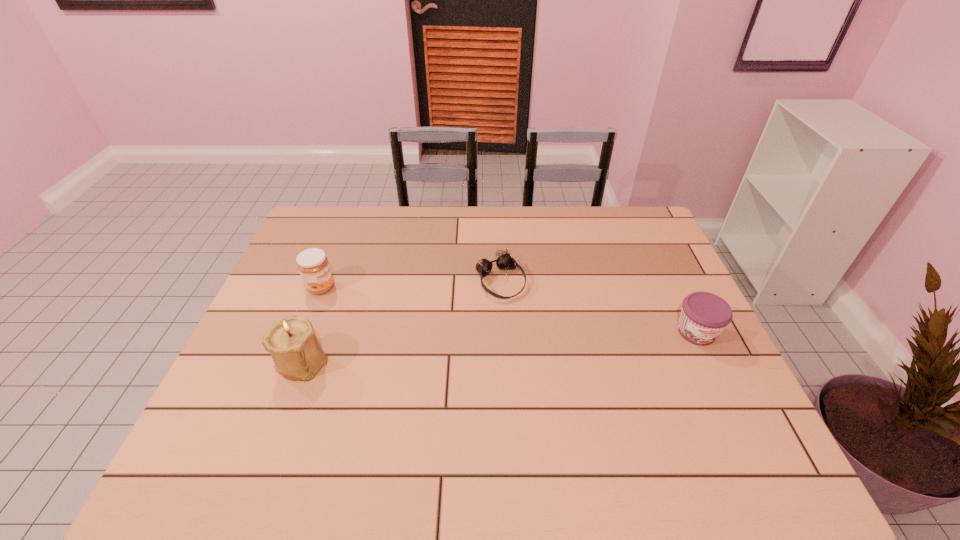
Where is `candle_holder`? candle_holder is located at coordinates 292,343.

Find the location of a particular element. Image resolution: width=960 pixels, height=540 pixels. the right jam is located at coordinates (704, 315).

Locate an element on the screen. This screenshot has width=960, height=540. the rightmost object is located at coordinates (704, 315).

Identify the location of the second tallest object. The height and width of the screenshot is (540, 960). (313, 265).

Find the location of `the left jam`. the left jam is located at coordinates 313,265.

The height and width of the screenshot is (540, 960). I want to click on goggles, so click(x=504, y=261).

This screenshot has width=960, height=540. I want to click on the third object from left to right, so click(x=504, y=261).

The height and width of the screenshot is (540, 960). I want to click on blank space located 0.270m on the back of the tallest object, so click(x=335, y=273).

Locate an element on the screen. This screenshot has width=960, height=540. free space located on the front label of the rightmost object is located at coordinates (742, 428).

The height and width of the screenshot is (540, 960). Find the location of `free space located on the front label of the third shortest object`. free space located on the front label of the third shortest object is located at coordinates (373, 308).